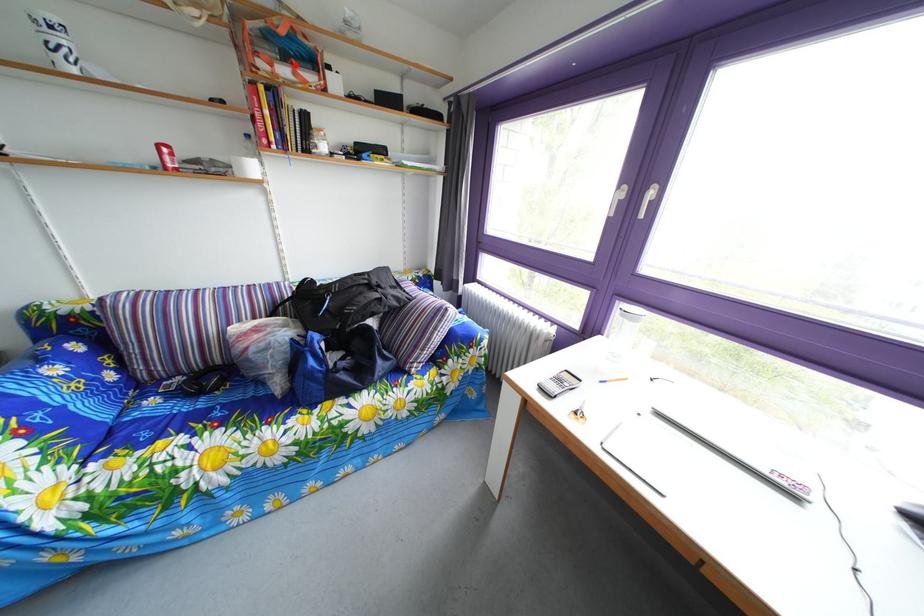
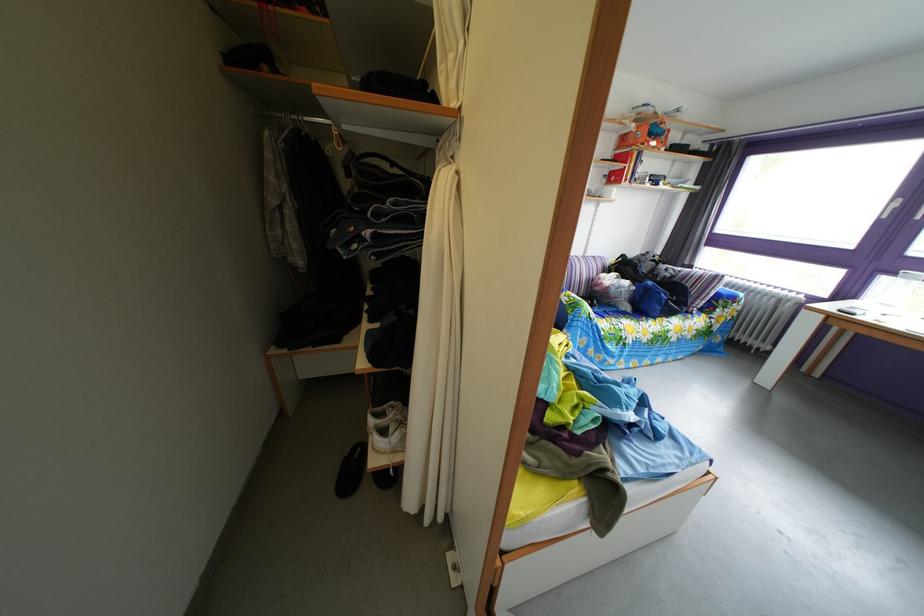
Question: I am providing you with two images of the same scene from different viewpoints. A red point is marked on the first image. At the location where the point appears in image 1, is it still visible in image 2?

Choices:
 (A) Yes
 (B) No

Answer: (A)